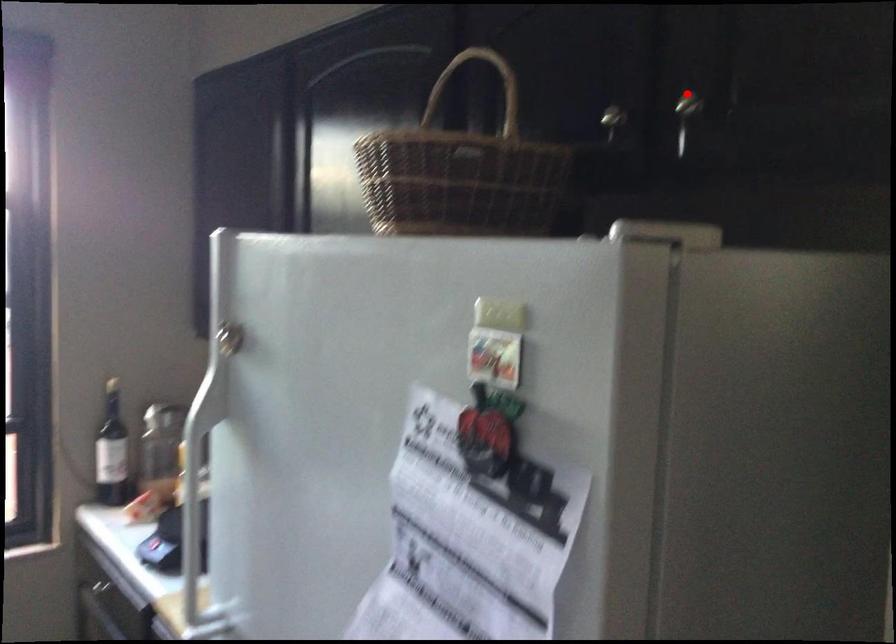
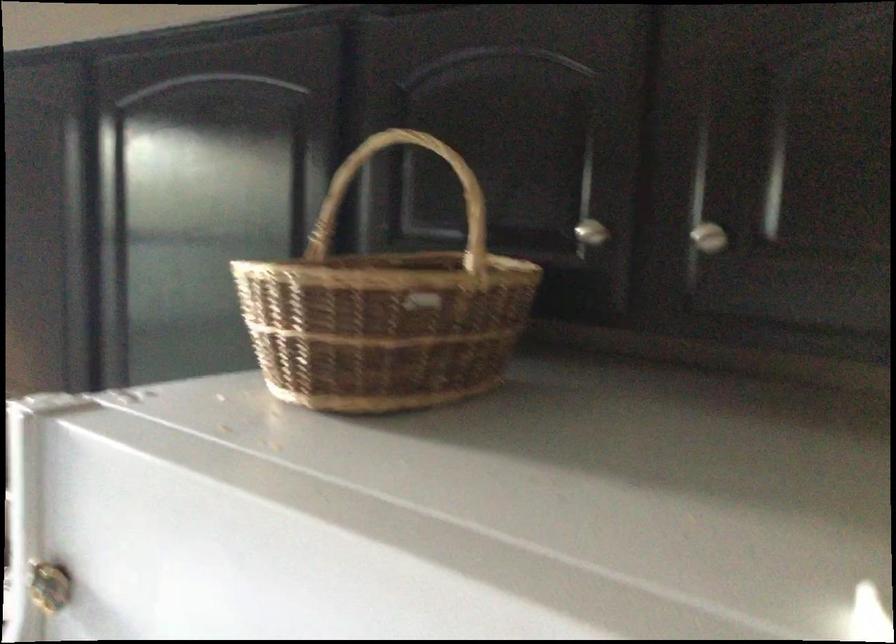
Question: I am providing you with two images of the same scene from different viewpoints. Image1 has a red point marked. In image2, the corresponding 3D location appears at what relative position? Reply with the corresponding letter.

Choices:
 (A) Closer
 (B) Farther

Answer: (A)